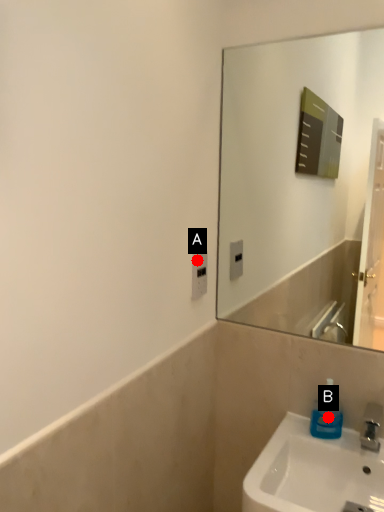
Question: Two points are circled on the image, labeled by A and B beside each circle. Among these points, which one is farthest from the camera?

Choices:
 (A) A is further
 (B) B is further

Answer: (A)